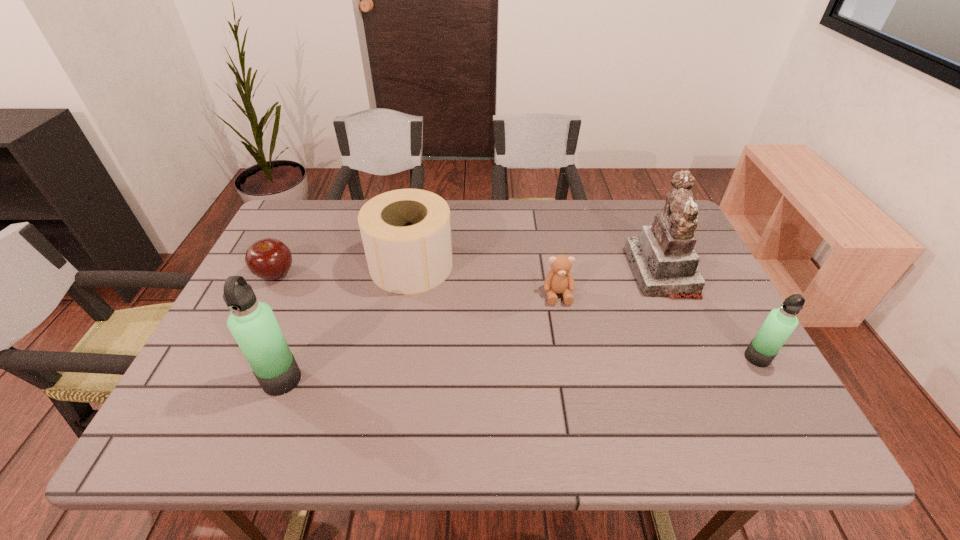
This screenshot has height=540, width=960. In order to click on free space for an extra thermos_bottle to achieve even spacing in this screenshot , I will do `click(525, 368)`.